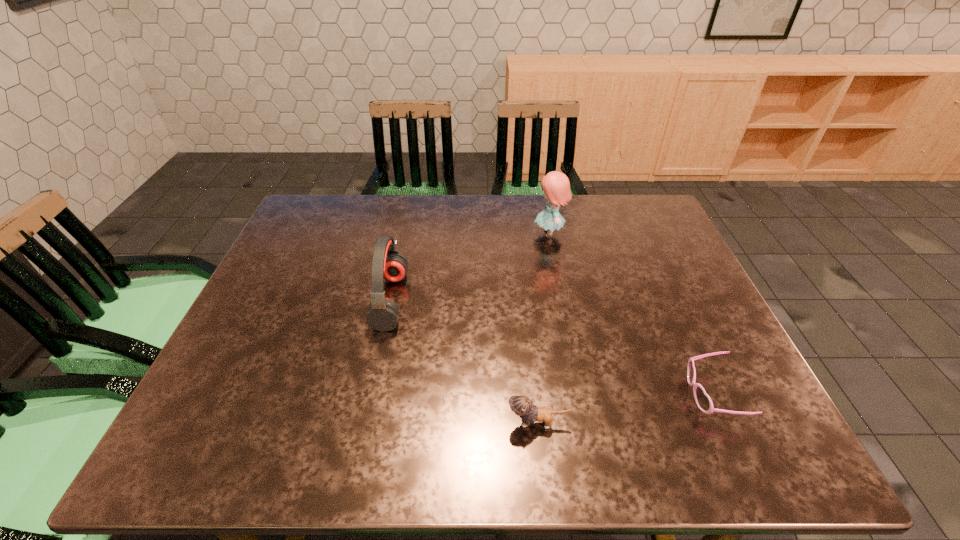
Find the location of `doll`. doll is located at coordinates (556, 185).

Find the location of a particular element. Image resolution: width=960 pixels, height=540 pixels. earphone is located at coordinates (387, 262).

Identify the location of the third nearest object. The width and height of the screenshot is (960, 540). (387, 262).

Image resolution: width=960 pixels, height=540 pixels. What are the coordinates of `kitten` in the screenshot? It's located at (522, 406).

Identify the location of sunglasses. (703, 401).

The height and width of the screenshot is (540, 960). Find the location of `the rightmost object`. the rightmost object is located at coordinates (703, 401).

This screenshot has width=960, height=540. I want to click on vacant space located on the front-facing side of the doll, so click(421, 233).

Locate an element on the screen. This screenshot has width=960, height=540. free location located 0.350m on the front-facing side of the doll is located at coordinates (419, 233).

I want to click on vacant space located 0.180m on the front-facing side of the doll, so click(x=474, y=233).

You are a GUI agent. You are given a task and a screenshot of the screen. Output one action in this format:
    pyautogui.click(x=<x>, y=<y>)
    Task: Click on the free region located on the ear cups of the third nearest object
    This screenshot has width=960, height=540.
    Given the screenshot: What is the action you would take?
    pyautogui.click(x=464, y=300)